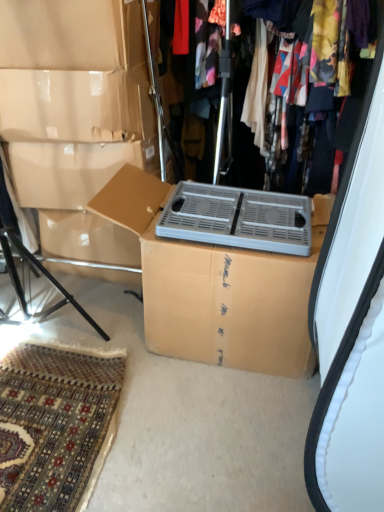
Question: Are metallic silver heater at upper center and cardboard box at center located far from each other?

Choices:
 (A) yes
 (B) no

Answer: (B)

Question: Considering the relative sizes of metallic silver heater at upper center and cardboard box at center in the image provided, is metallic silver heater at upper center shorter than cardboard box at center?

Choices:
 (A) yes
 (B) no

Answer: (B)

Question: Can you confirm if metallic silver heater at upper center is smaller than cardboard box at center?

Choices:
 (A) yes
 (B) no

Answer: (B)

Question: Is metallic silver heater at upper center closer to the viewer compared to cardboard box at center?

Choices:
 (A) yes
 (B) no

Answer: (B)

Question: From a real-world perspective, is metallic silver heater at upper center located beneath cardboard box at center?

Choices:
 (A) no
 (B) yes

Answer: (A)

Question: Is metallic silver heater at upper center facing away from cardboard box at center?

Choices:
 (A) no
 (B) yes

Answer: (A)

Question: From the image's perspective, is cardboard box at center above metallic silver heater at upper center?

Choices:
 (A) no
 (B) yes

Answer: (A)

Question: Considering the relative positions of cardboard box at center and metallic silver heater at upper center in the image provided, is cardboard box at center behind metallic silver heater at upper center?

Choices:
 (A) yes
 (B) no

Answer: (B)

Question: Is cardboard box at center looking in the opposite direction of metallic silver heater at upper center?

Choices:
 (A) yes
 (B) no

Answer: (B)

Question: Is cardboard box at center closer to camera compared to metallic silver heater at upper center?

Choices:
 (A) yes
 (B) no

Answer: (A)

Question: Is cardboard box at center not within metallic silver heater at upper center?

Choices:
 (A) yes
 (B) no

Answer: (A)

Question: Is cardboard box at center thinner than metallic silver heater at upper center?

Choices:
 (A) yes
 (B) no

Answer: (B)

Question: From a real-world perspective, is gray plastic crate at center positioned over cardboard box at center based on gravity?

Choices:
 (A) yes
 (B) no

Answer: (A)